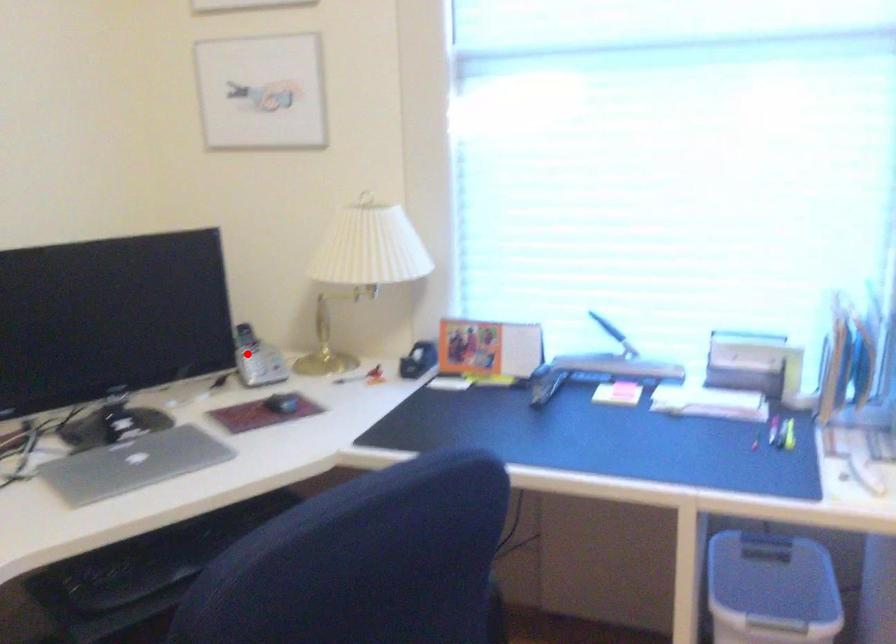
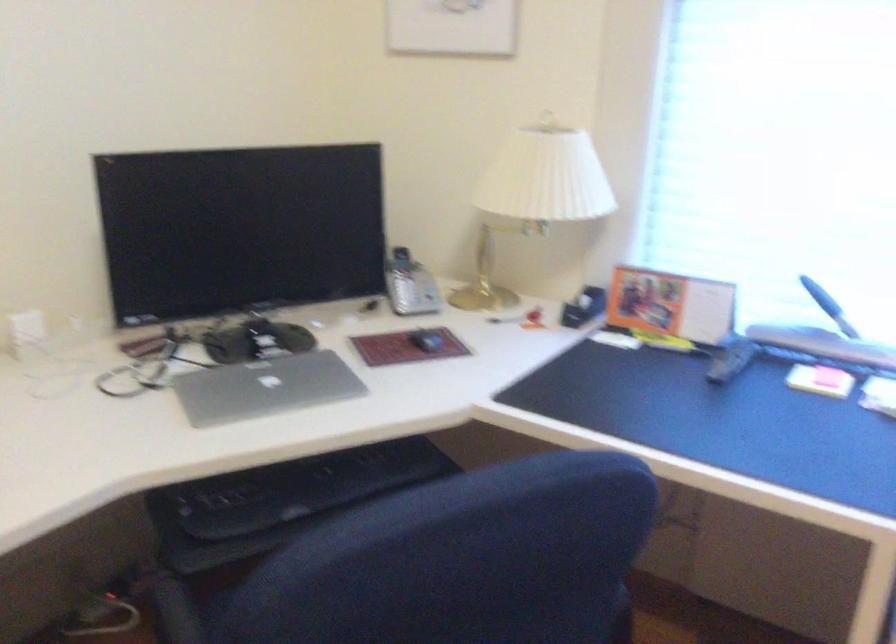
Locate, in the second image, the point that corresponds to the highlighted location in the first image.

(401, 281)